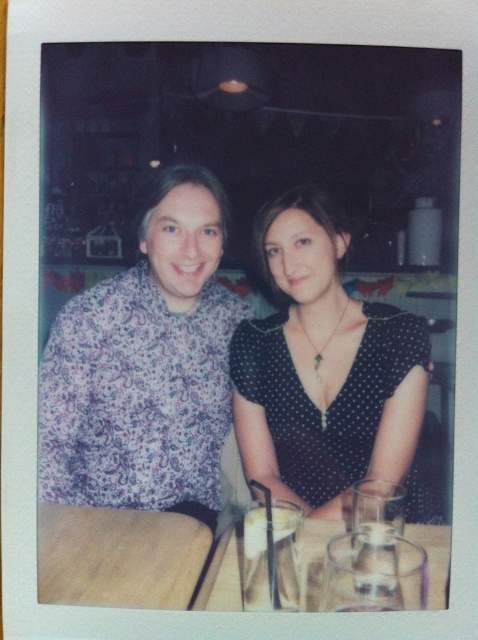
In the scene shown: Is black dotted dress at center bigger than wooden table at lower left?

Yes.

Image resolution: width=478 pixels, height=640 pixels. What do you see at coordinates (324, 369) in the screenshot? I see `black dotted dress at center` at bounding box center [324, 369].

The width and height of the screenshot is (478, 640). In order to click on black dotted dress at center in this screenshot , I will do `click(324, 369)`.

In the scene shown: Between black dotted dress at center and clear glass table at center, which one has less height?

Standing shorter between the two is clear glass table at center.

Between point (299, 230) and point (434, 538), which one is positioned in front?

Point (434, 538) is in front.

Who is more distant from viewer, (304,440) or (442,538)?

Positioned behind is point (304,440).

Find the location of a particular element. This screenshot has width=478, height=640. black dotted dress at center is located at coordinates (324, 369).

Between polka dot dress at center and black dotted dress at center, which one appears on the left side from the viewer's perspective?

Positioned to the left is polka dot dress at center.

Measure the distance between point (196, 216) and camera.

Point (196, 216) and camera are 4.43 feet apart from each other.

Find the location of a particular element. This screenshot has height=640, width=478. polka dot dress at center is located at coordinates (145, 365).